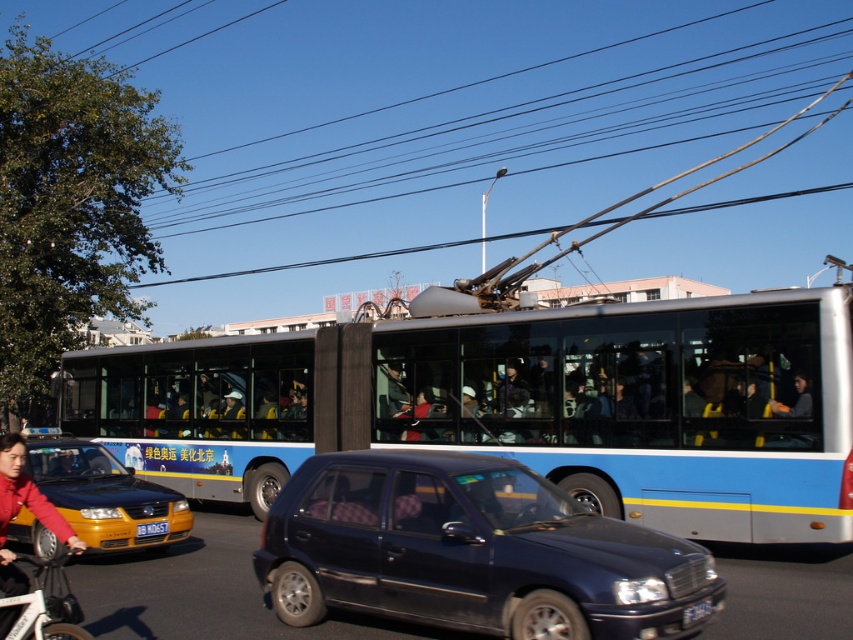
Who is lower down, blue metallic bus at center or blue metallic license plate at center?

Positioned lower is blue metallic license plate at center.

Is point (61, 424) positioned behind point (149, 528)?

Yes, point (61, 424) is behind point (149, 528).

Does point (442, 349) come behind point (144, 532)?

Yes, point (442, 349) is behind point (144, 532).

The height and width of the screenshot is (640, 853). What are the coordinates of `blue metallic bus at center` in the screenshot? It's located at click(x=518, y=406).

Can you confirm if dark blue matte car at center is taller than yellow matte taxi at lower left?

Indeed, dark blue matte car at center has a greater height compared to yellow matte taxi at lower left.

Is point (480, 476) positioned in front of point (47, 472)?

Yes, point (480, 476) is closer to viewer.

Where is `dark blue matte car at center`? dark blue matte car at center is located at coordinates (473, 552).

Is the position of red fabric jacket at lower left less distant than that of white matte bicycle at lower left?

No, red fabric jacket at lower left is behind white matte bicycle at lower left.

Locate an element on the screen. The width and height of the screenshot is (853, 640). red fabric jacket at lower left is located at coordinates (18, 509).

Between point (1, 550) and point (61, 614), which one is positioned in front?

Point (61, 614) is in front.

Image resolution: width=853 pixels, height=640 pixels. Identify the location of red fabric jacket at lower left. (18, 509).